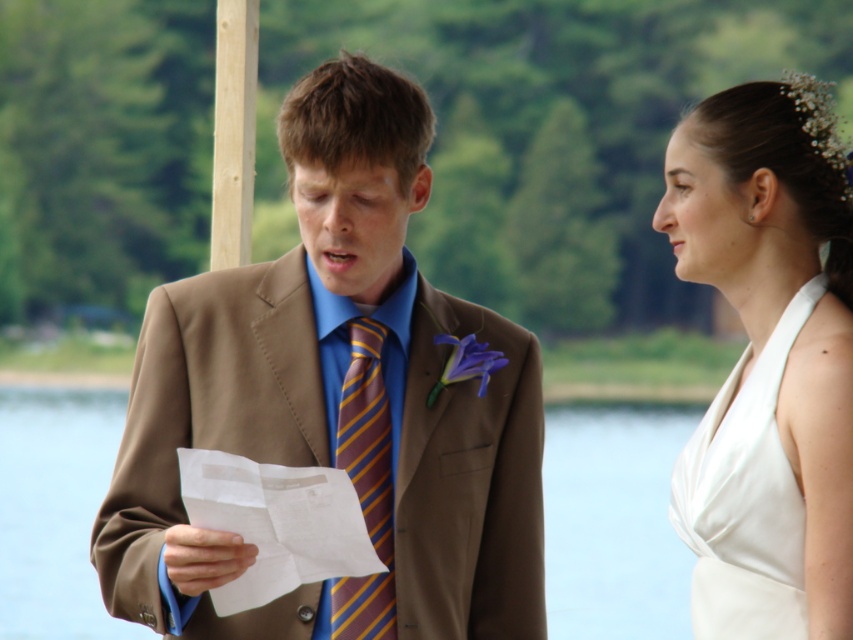
Who is higher up, brown textured suit at center or white satin dress at upper right?

white satin dress at upper right is above.

Does brown textured suit at center have a greater width compared to white satin dress at upper right?

Yes.

Who is more forward, (178,324) or (781,456)?

Point (781,456)

The width and height of the screenshot is (853, 640). In order to click on brown textured suit at center in this screenshot , I will do `click(337, 403)`.

Is brown textured suit at center shorter than striped silk tie at center?

Incorrect, brown textured suit at center's height does not fall short of striped silk tie at center's.

Is point (343, 120) farther from viewer compared to point (367, 412)?

No, it is in front of (367, 412).

What do you see at coordinates (337, 403) in the screenshot? I see `brown textured suit at center` at bounding box center [337, 403].

Locate an element on the screen. This screenshot has width=853, height=640. brown textured suit at center is located at coordinates (337, 403).

Is white satin dress at upper right behind white paper at center?

No, it is in front of white paper at center.

Between point (804, 426) and point (42, 449), which one is positioned in front?

Point (804, 426)

What do you see at coordinates (769, 360) in the screenshot? This screenshot has width=853, height=640. I see `white satin dress at upper right` at bounding box center [769, 360].

At what (x,y) coordinates should I click in order to perform the action: click on white satin dress at upper right. Please return your answer as a coordinate pair (x, y). Looking at the image, I should click on (769, 360).